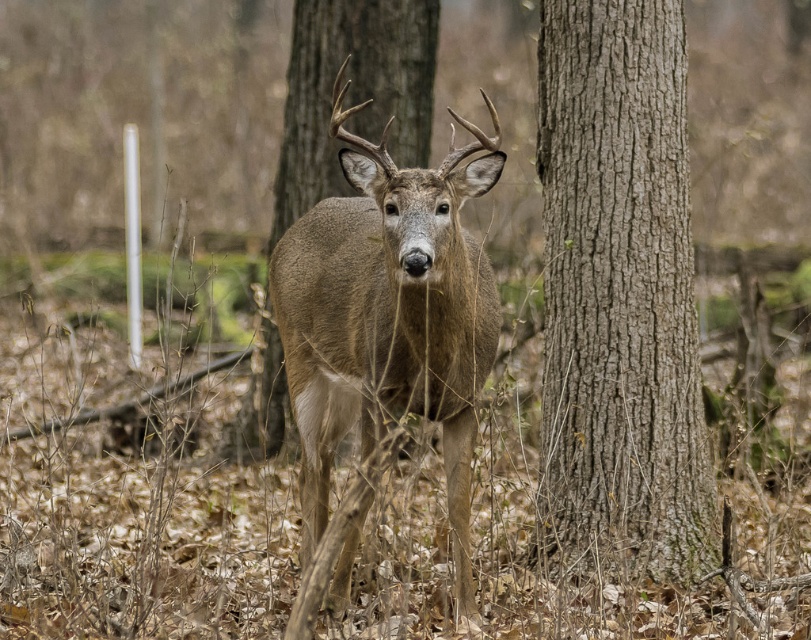
Can you confirm if brown fur deer at center is shorter than brown rough bark tree at center?

Incorrect, brown fur deer at center's height does not fall short of brown rough bark tree at center's.

Does brown fur deer at center have a larger size compared to brown rough bark tree at center?

Yes, brown fur deer at center is bigger than brown rough bark tree at center.

This screenshot has height=640, width=811. I want to click on brown fur deer at center, so click(x=383, y=336).

Can you confirm if gray textured bark at center is bigger than brown rough bark tree at center?

Indeed, gray textured bark at center has a larger size compared to brown rough bark tree at center.

You are a GUI agent. You are given a task and a screenshot of the screen. Output one action in this format:
    pyautogui.click(x=<x>, y=<y>)
    Task: Click on the gray textured bark at center
    The height and width of the screenshot is (640, 811).
    Given the screenshot: What is the action you would take?
    pyautogui.click(x=618, y=296)

Which is behind, point (573, 8) or point (303, 145)?

Point (303, 145)

Find the location of `gray textured bark at center`. gray textured bark at center is located at coordinates (618, 296).

Is point (689, 282) more distant than point (339, 589)?

Yes, point (689, 282) is behind point (339, 589).

Which of these two, gray textured bark at center or brown fur deer at center, stands taller?

gray textured bark at center

Between point (663, 380) and point (492, 317), which one is positioned in front?

Positioned in front is point (492, 317).

Identify the location of gray textured bark at center. (618, 296).